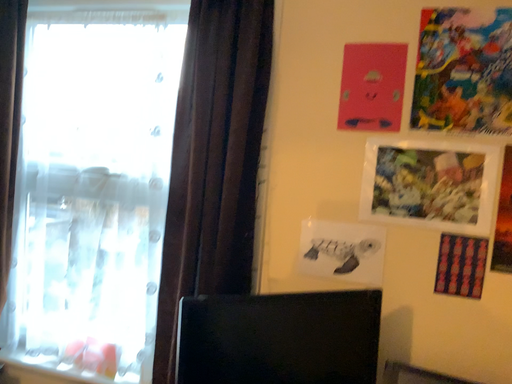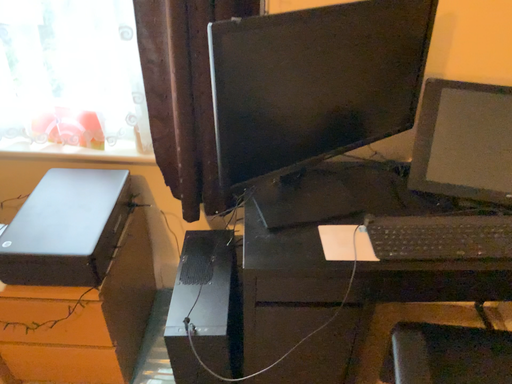
Question: How did the camera likely rotate when shooting the video?

Choices:
 (A) rotated left
 (B) rotated right

Answer: (B)